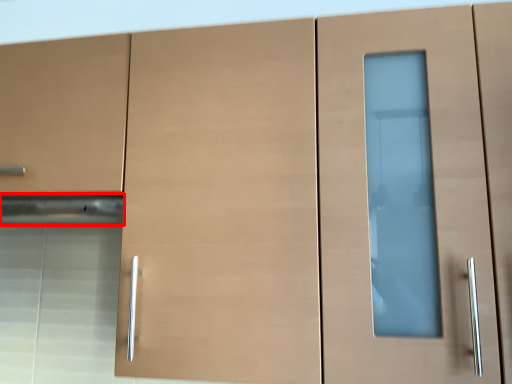
Question: Considering the relative positions of exhaust hood (annotated by the red box) and drawer in the image provided, where is exhaust hood (annotated by the red box) located with respect to the staircase?

Choices:
 (A) right
 (B) left

Answer: (A)